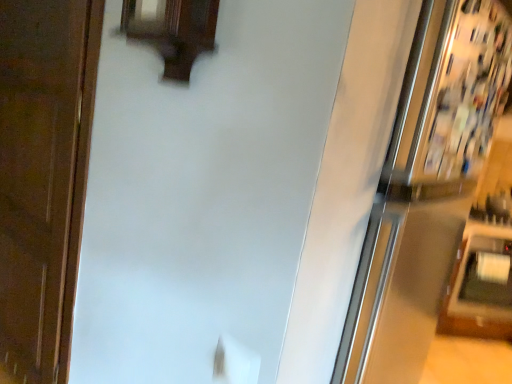
Question: In terms of size, does brown wood door at left appear bigger or smaller than white glossy fridge at upper right?

Choices:
 (A) small
 (B) big

Answer: (A)

Question: From a real-world perspective, is brown wood door at left above or below white glossy fridge at upper right?

Choices:
 (A) above
 (B) below

Answer: (B)

Question: Relative to white glossy fridge at upper right, is brown wood door at left in front or behind?

Choices:
 (A) front
 (B) behind

Answer: (B)

Question: Looking at their shapes, would you say white glossy fridge at upper right is wider or thinner than brown wood door at left?

Choices:
 (A) thin
 (B) wide

Answer: (B)

Question: From the image's perspective, is white glossy fridge at upper right located above or below brown wood door at left?

Choices:
 (A) above
 (B) below

Answer: (B)

Question: From a real-world perspective, is white glossy fridge at upper right positioned above or below brown wood door at left?

Choices:
 (A) below
 (B) above

Answer: (B)

Question: Considering the positions of white glossy fridge at upper right and brown wood door at left in the image, is white glossy fridge at upper right bigger or smaller than brown wood door at left?

Choices:
 (A) small
 (B) big

Answer: (B)